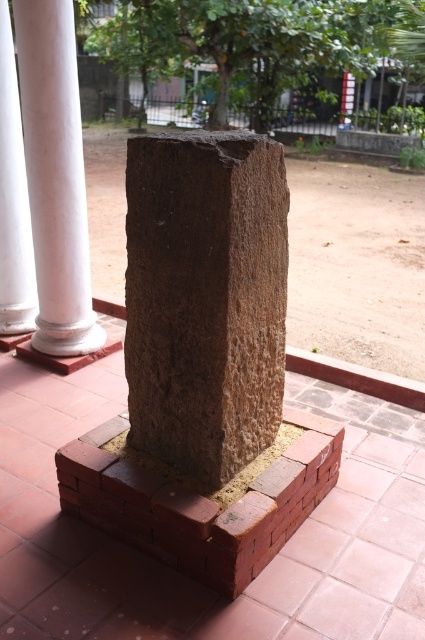
How distant is brown rough stone at center from brown rough stone pillar at center?

The distance of brown rough stone at center from brown rough stone pillar at center is 34.64 inches.

Does brown rough stone at center have a greater height compared to brown rough stone pillar at center?

Incorrect, brown rough stone at center's height is not larger of brown rough stone pillar at center's.

Is point (112, 595) positioned before point (212, 214)?

That is False.

Identify the location of brown rough stone at center. The height and width of the screenshot is (640, 425). (187, 577).

Between point (192, 472) and point (328, 438), which one is positioned in front?

Point (192, 472) is more forward.

Is point (212, 397) closer to viewer compared to point (206, 518)?

No, (212, 397) is behind (206, 518).

You are a GUI agent. You are given a task and a screenshot of the screen. Output one action in this format:
    pyautogui.click(x=<x>, y=<y>)
    Task: Click on the brown rough stone pillar at center
    The height and width of the screenshot is (640, 425).
    Given the screenshot: What is the action you would take?
    pyautogui.click(x=204, y=298)

Find the location of a particular element. brown rough stone pillar at center is located at coordinates (204, 298).

Describe the element at coordinates (204, 298) in the screenshot. I see `brown rough stone pillar at center` at that location.

The image size is (425, 640). What are the coordinates of `brown rough stone pillar at center` in the screenshot? It's located at (204, 298).